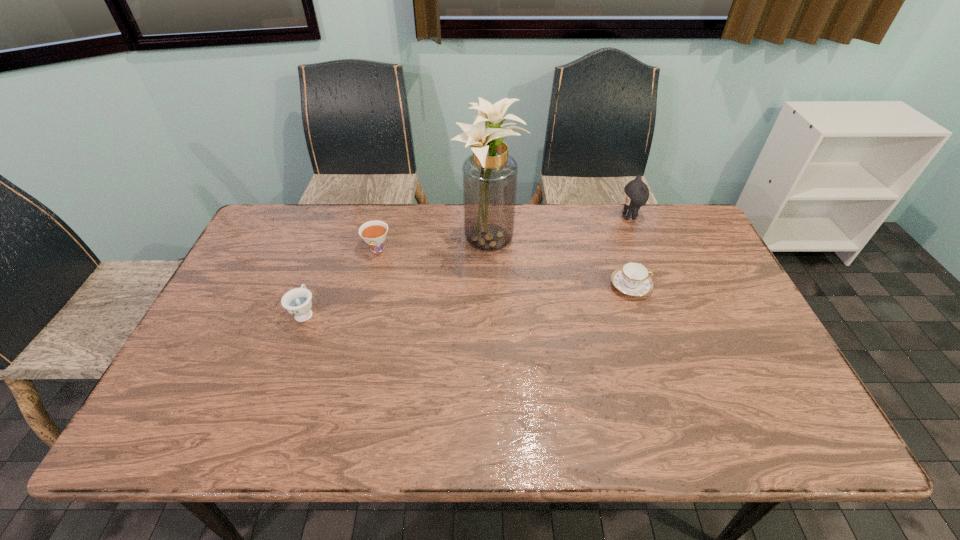
Locate an element on the screen. vacant point located between the leftmost teacup and the second tallest object is located at coordinates (468, 265).

You are a GUI agent. You are given a task and a screenshot of the screen. Output one action in this format:
    pyautogui.click(x=<x>, y=<y>)
    Task: Click on the unoccupied area between the farthest teacup and the rightmost teacup
    
    Given the screenshot: What is the action you would take?
    pyautogui.click(x=504, y=268)

Identify the location of free space between the shortest object and the leftmost object. This screenshot has width=960, height=540. (468, 299).

Identify the location of free space between the farthest teacup and the leftmost teacup. This screenshot has width=960, height=540. (341, 281).

Identify which object is located as the nearest to the fourth shortest object. Please provide its 2D coordinates. Your answer should be formatted as a tuple, i.e. [(x, y)], where the tuple contains the x and y coordinates of a point satisfying the conditions above.

[(633, 279)]

Select which object is the fourth closest to the shortest object. Please provide its 2D coordinates. Your answer should be formatted as a tuple, i.e. [(x, y)], where the tuple contains the x and y coordinates of a point satisfying the conditions above.

[(297, 301)]

You are a GUI agent. You are given a task and a screenshot of the screen. Output one action in this format:
    pyautogui.click(x=<x>, y=<y>)
    Task: Click on the teacup that can be found as the closest to the shortest teacup
    This screenshot has height=540, width=960.
    Given the screenshot: What is the action you would take?
    pyautogui.click(x=374, y=233)

At what (x,y) coordinates should I click in order to perform the action: click on the closest teacup to the second teacup from right to left. Please return your answer as a coordinate pair (x, y). Looking at the image, I should click on (297, 301).

Locate an element on the screen. vacant region that satisfies the following two spatial constraints: 1. on the front-facing side of the second tallest object; 2. on the front side of the tallest object is located at coordinates (639, 242).

Where is `free spot that satisfies the following two spatial constraints: 1. on the front-facing side of the fourth shortest object; 2. on the side of the second object from left to right with the handle`? free spot that satisfies the following two spatial constraints: 1. on the front-facing side of the fourth shortest object; 2. on the side of the second object from left to right with the handle is located at coordinates (642, 249).